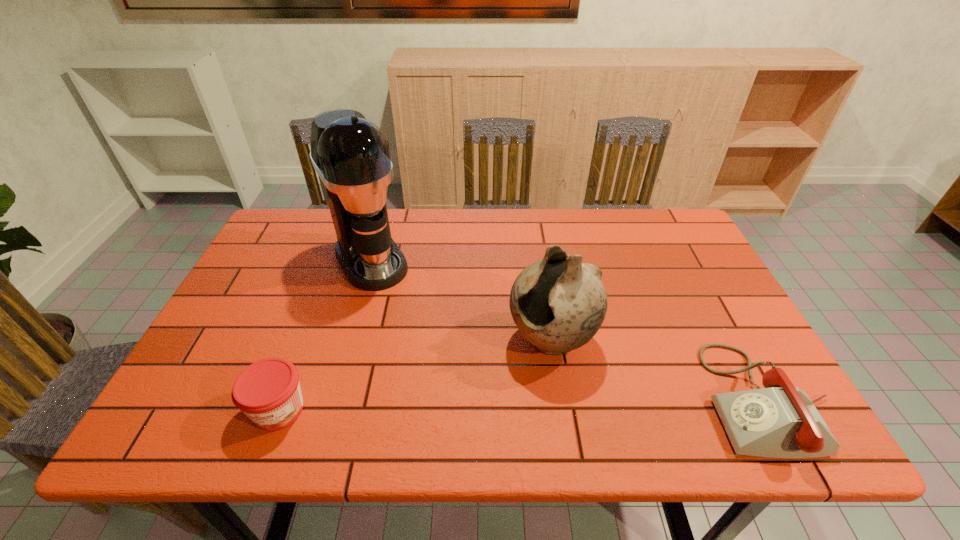
Locate an element on the screen. The height and width of the screenshot is (540, 960). blank space located 0.300m place cup under the spout of the coffee maker is located at coordinates (432, 363).

What are the coordinates of `vacant space located 0.290m place cup under the spout of the coffee maker` in the screenshot? It's located at (430, 360).

The width and height of the screenshot is (960, 540). Find the location of `object present at the far edge`. object present at the far edge is located at coordinates (351, 155).

Locate an element on the screen. jam present at the near edge is located at coordinates (268, 391).

You are a GUI agent. You are given a task and a screenshot of the screen. Output one action in this format:
    pyautogui.click(x=<x>, y=<y>)
    Task: Click on the telephone at the near edge
    Image resolution: width=960 pixels, height=540 pixels.
    Given the screenshot: What is the action you would take?
    pyautogui.click(x=780, y=421)

You are a GUI agent. You are given a task and a screenshot of the screen. Output one action in this format:
    pyautogui.click(x=<x>, y=<y>)
    Task: Click on the pottery at the near edge
    Image resolution: width=960 pixels, height=540 pixels.
    Given the screenshot: What is the action you would take?
    tap(558, 303)

This screenshot has height=540, width=960. I want to click on object at the right edge, so click(780, 421).

The height and width of the screenshot is (540, 960). What are the coordinates of `object located in the near right corner section of the desktop` in the screenshot? It's located at (780, 421).

Locate an element on the screen. free space at the far edge is located at coordinates (444, 226).

I want to click on free space at the near edge of the desktop, so pyautogui.click(x=391, y=400).